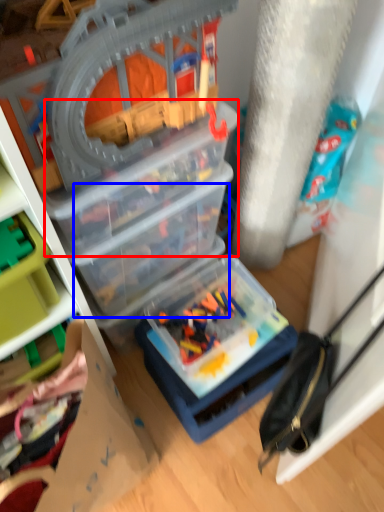
Question: Which object appears closest to the camera in this image, box (highlighted by a red box) or box (highlighted by a blue box)?

Choices:
 (A) box
 (B) box

Answer: (A)